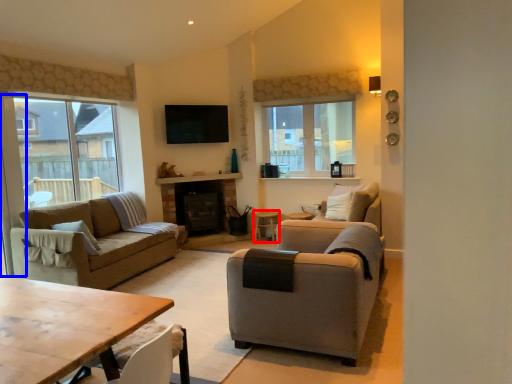
Question: Which object is closer to the camera taking this photo, side table (highlighted by a red box) or screen door (highlighted by a blue box)?

Choices:
 (A) side table
 (B) screen door

Answer: (B)